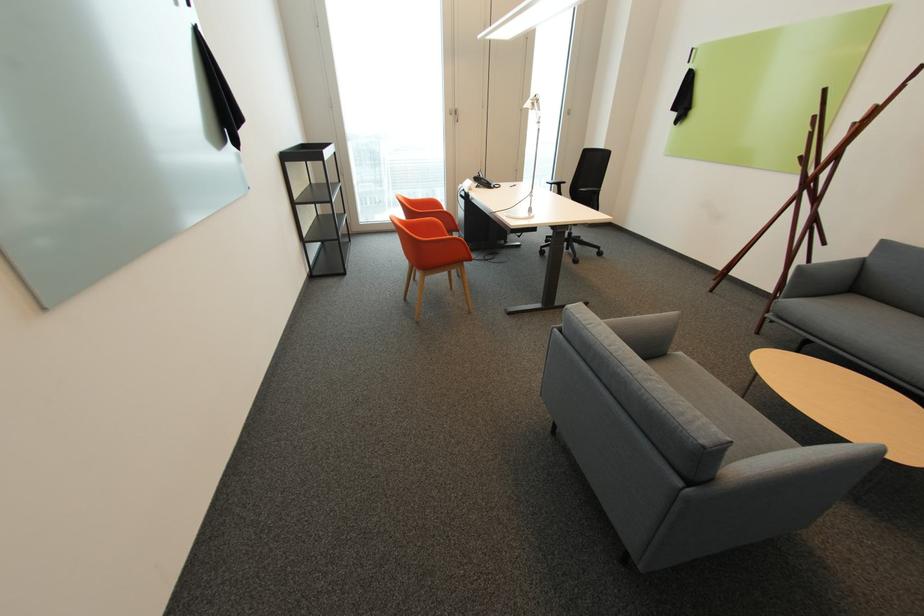
This screenshot has width=924, height=616. What do you see at coordinates (441, 252) in the screenshot? I see `the orange chair sitting surface` at bounding box center [441, 252].